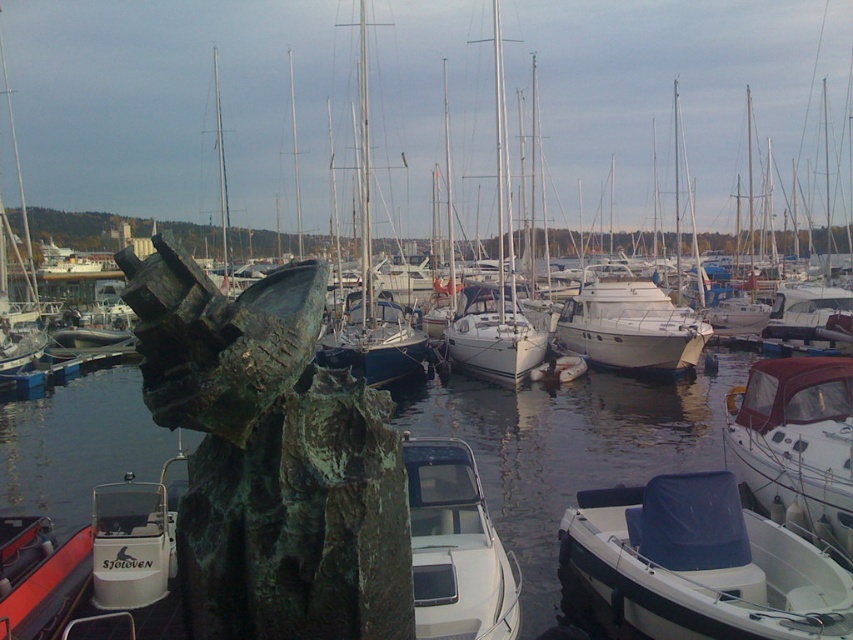
Question: Which of the following is the farthest from the observer?

Choices:
 (A) green patina statue at center
 (B) white glossy boat at center

Answer: (B)

Question: Considering the real-world distances, which object is farthest from the green patina statue at center?

Choices:
 (A) white glossy boat at lower right
 (B) white plastic boat at lower right
 (C) white glossy boat at center

Answer: (A)

Question: Where is white glossy boat at lower right located in relation to white glossy boat at center in the image?

Choices:
 (A) left
 (B) right

Answer: (B)

Question: Where is green patina statue at center located in relation to white glossy boat at lower right in the image?

Choices:
 (A) left
 (B) right

Answer: (A)

Question: Which object is closer to the camera taking this photo?

Choices:
 (A) white plastic boat at lower right
 (B) white glossy motorboat at center
 (C) white glossy boat at center

Answer: (C)

Question: Does white glossy motorboat at center appear on the right side of white glossy boat at center?

Choices:
 (A) yes
 (B) no

Answer: (B)